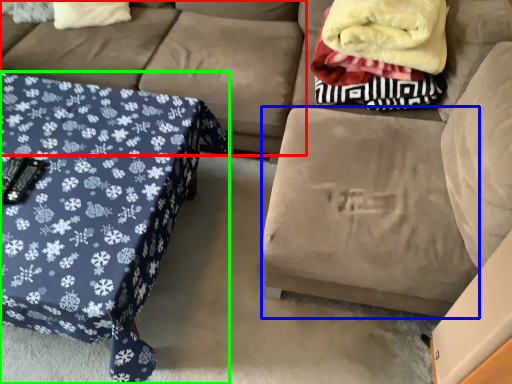
Question: Considering the real-world distances, which object is closest to couch (highlighted by a red box)? footrest (highlighted by a blue box) or table (highlighted by a green box).

Choices:
 (A) footrest
 (B) table

Answer: (B)